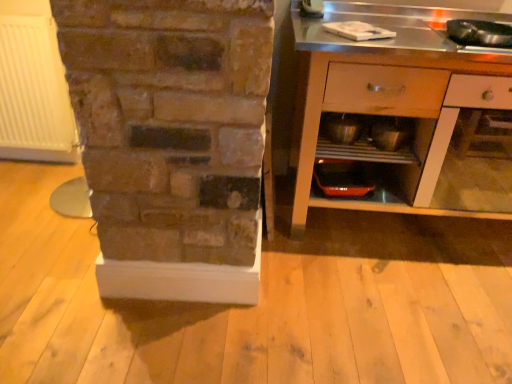
This screenshot has width=512, height=384. What are the coordinates of `vacant space underneath white matte radiator at left (from a real-world perspective)` in the screenshot? It's located at (44, 154).